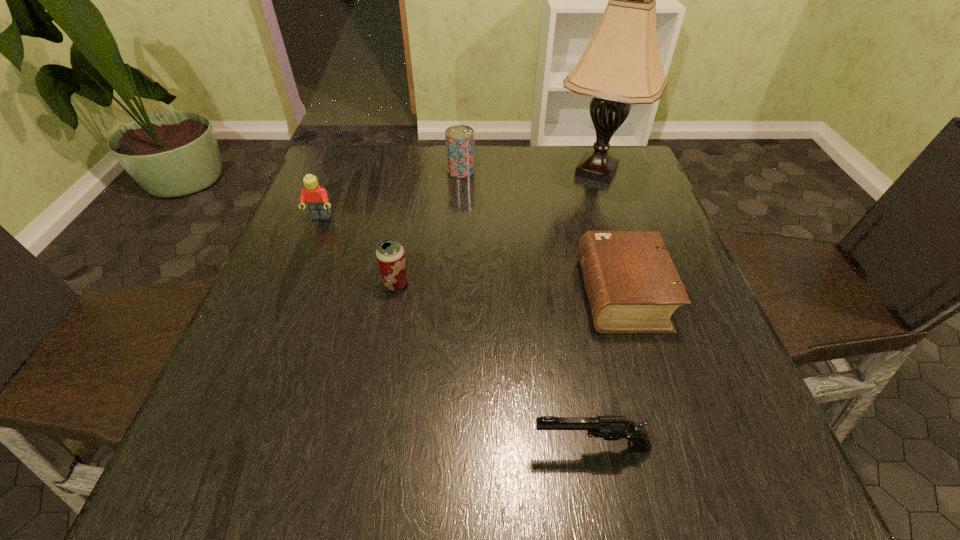
This screenshot has width=960, height=540. I want to click on blank space at the far left corner, so click(x=329, y=150).

You are a GUI agent. You are given a task and a screenshot of the screen. Output one action in this format:
    pyautogui.click(x=<x>, y=<y>)
    Task: Click on the free location at the far right corner of the desktop
    The image size is (960, 540).
    Given the screenshot: What is the action you would take?
    pyautogui.click(x=593, y=193)

This screenshot has height=540, width=960. I want to click on vacant area that lies between the right beer can and the Lego, so click(391, 194).

Image resolution: width=960 pixels, height=540 pixels. What are the coordinates of `vacant area that lies between the tallest object and the right beer can` in the screenshot? It's located at (529, 171).

Locate an element on the screen. The width and height of the screenshot is (960, 540). free space that is in between the Bible and the Lego is located at coordinates (471, 256).

The width and height of the screenshot is (960, 540). Find the location of `blank region between the leftmost object and the Bible`. blank region between the leftmost object and the Bible is located at coordinates (471, 256).

You are a GUI agent. You are given a task and a screenshot of the screen. Output one action in this format:
    pyautogui.click(x=<x>, y=<y>)
    Task: Click on the free space between the fourth nearest object and the lamp
    
    Given the screenshot: What is the action you would take?
    pyautogui.click(x=459, y=194)

Find the location of a particular element. The image size is (960, 540). free point between the Bible and the nearest object is located at coordinates (607, 370).

Find the location of a particular element. This screenshot has width=960, height=540. free spot between the fourth object from right to left and the gun is located at coordinates (526, 309).

This screenshot has width=960, height=540. Find the location of `empty space between the Bible and the right beer can`. empty space between the Bible and the right beer can is located at coordinates (541, 232).